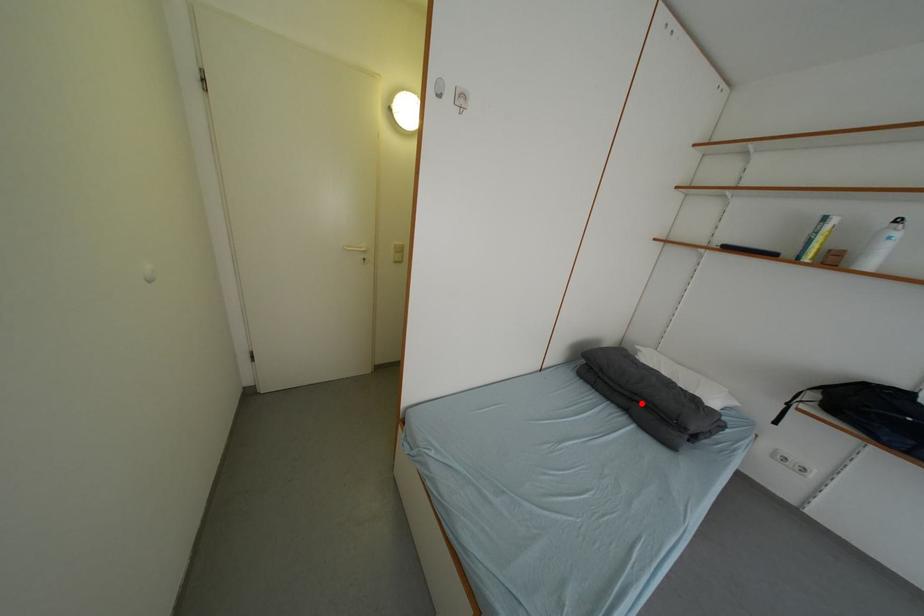
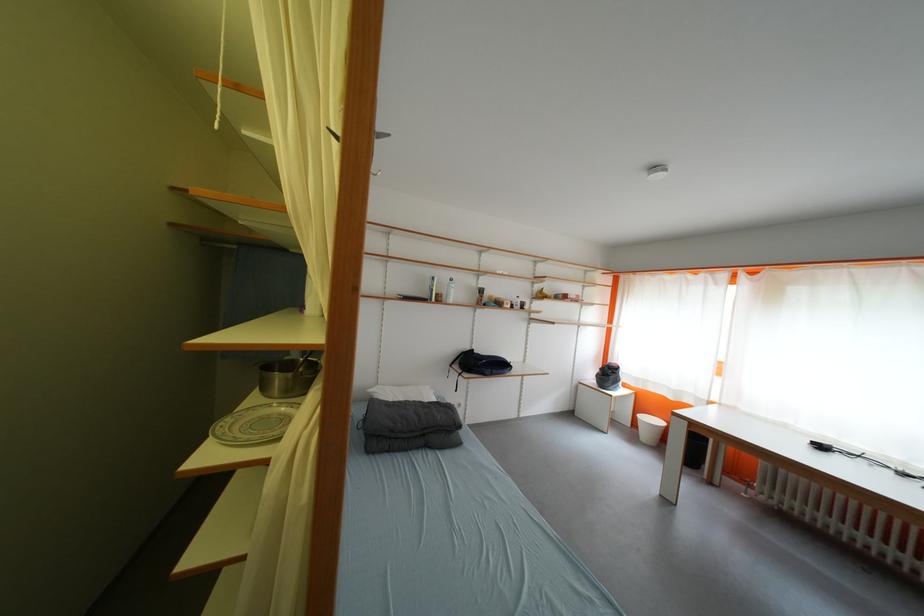
Question: I am providing you with two images of the same scene from different viewpoints. Image1 has a red point marked. In image2, the corresponding 3D location appears at what relative position? Reply with the corresponding letter.

Choices:
 (A) Closer
 (B) Farther

Answer: (B)